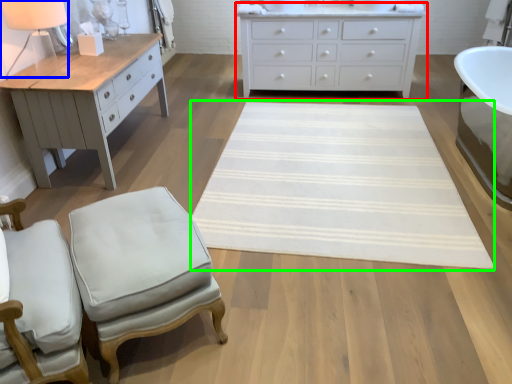
Question: Estimate the real-world distances between objects in this image. Which object is closer to chest of drawers (highlighted by a red box), table lamp (highlighted by a blue box) or mat (highlighted by a green box)?

Choices:
 (A) table lamp
 (B) mat

Answer: (B)